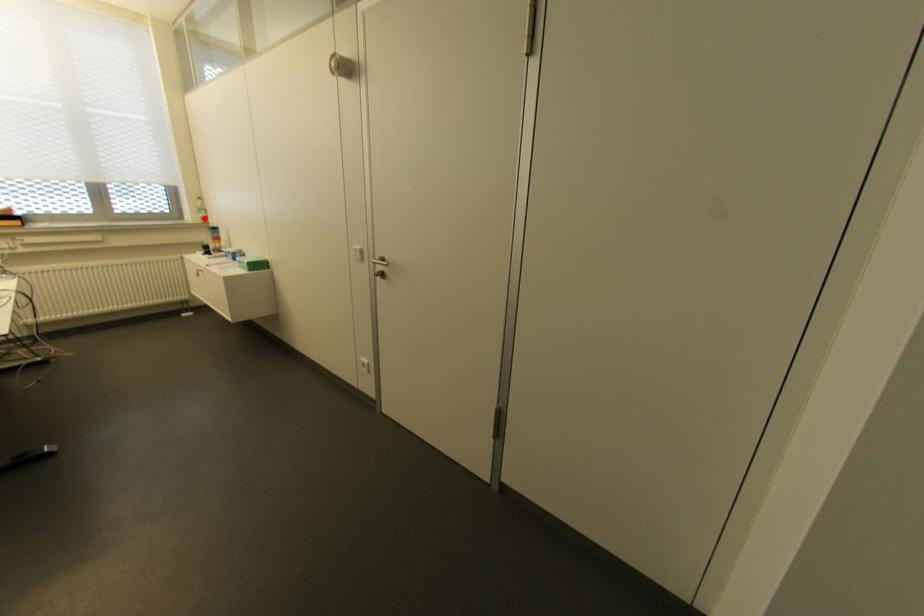
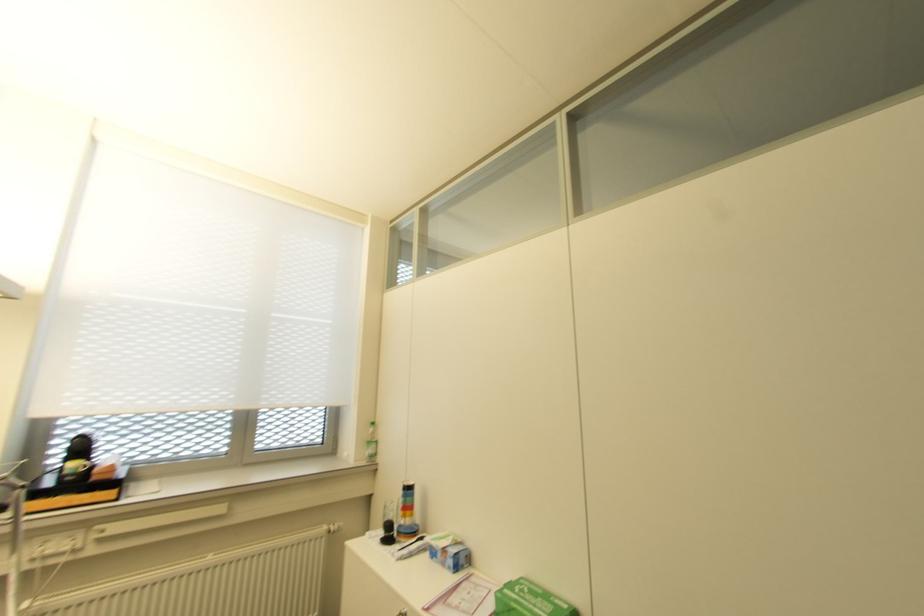
Question: I am providing you with two images of the same scene from different viewpoints. A red point is shown in image1. For the corresponding object point in image2, is it positioned nearer or farther from the camera?

Choices:
 (A) Nearer
 (B) Farther

Answer: (B)